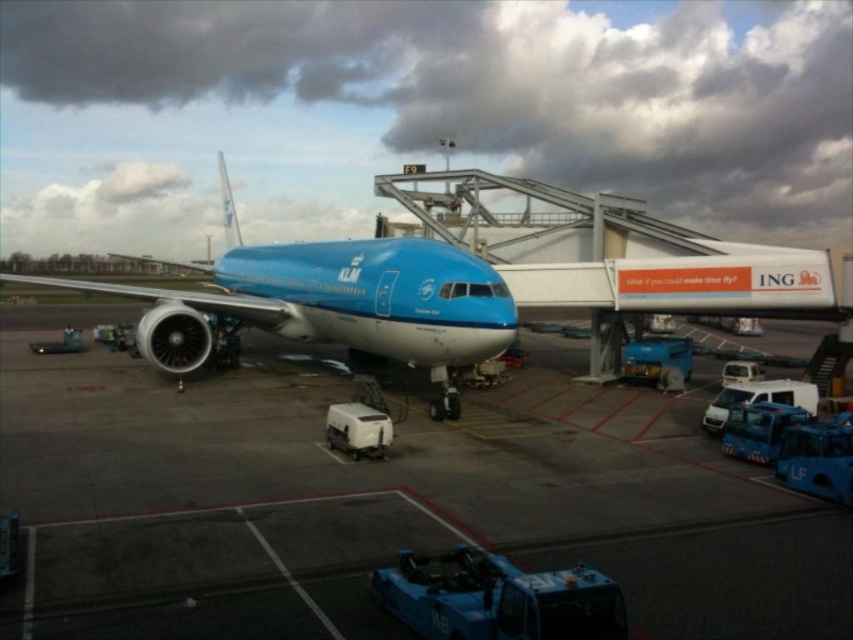
You are standing at the airport gate and see two points marked on the jet bridge. The first point is at coordinate point (x=28, y=416) and the second is at point (x=467, y=360). Which point is closer to your current position?

Point (x=28, y=416) is further to the camera than point (x=467, y=360), so the point closer to your current position is point (x=467, y=360).

You are a passenger waiting to board your flight. You see the matte white tarmac at center and the matte blue airplane at center. Which one is closer to you as you stand at the boarding gate?

The matte white tarmac at center is in front of the matte blue airplane at center, so it is closer to you as you stand at the boarding gate.

You are a pilot standing at the cockpit of the KLM Royal Dutch Airlines aircraft. You need to check the tarmac condition at a specific point. According to the image, what is the material and color of the surface at point (381, 500)?

The point (381, 500) indicates matte white tarmac at center.